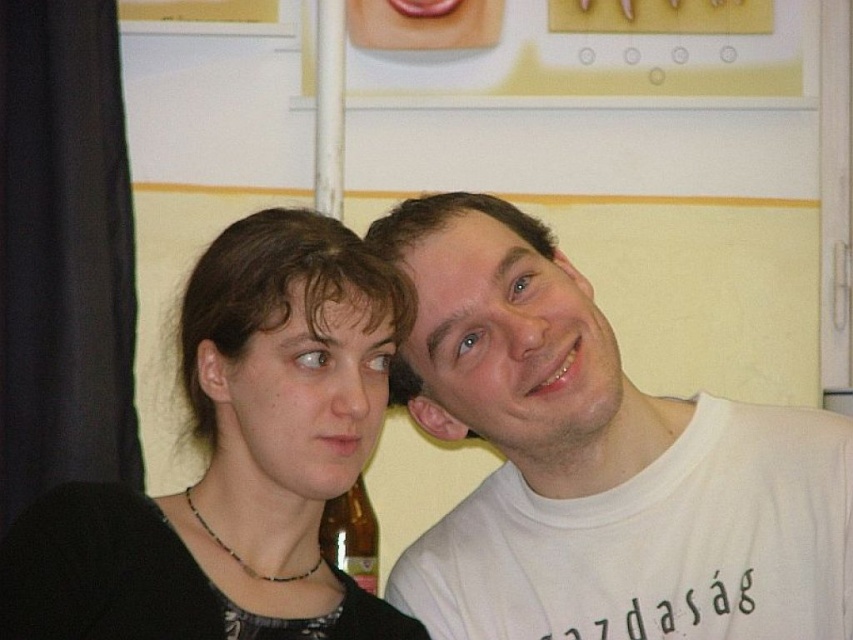
You are a photographer setting up a shot of the two people in the scene. You need to ensure that the black matte hair at center and the translucent glass bottle at lower center are both in frame. Based on their sizes, which object might require more space in the composition?

The black matte hair at center might require more space in the composition because it is wider than the translucent glass bottle at lower center.